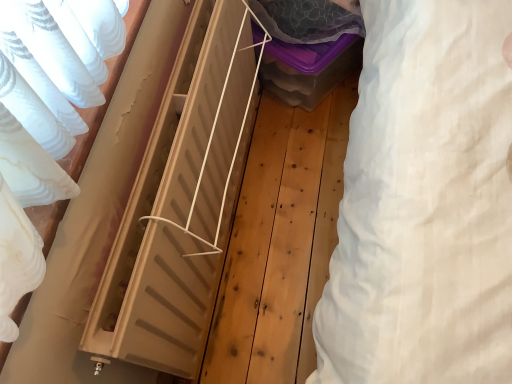
The width and height of the screenshot is (512, 384). Describe the element at coordinates (424, 203) in the screenshot. I see `white cotton sheet at right` at that location.

What are the coordinates of `translucent plastic storage box at center` in the screenshot? It's located at (308, 48).

Measure the distance between natural wood radiator at center and camera.

natural wood radiator at center is 27.64 inches from camera.

Locate an element on the screen. This screenshot has width=512, height=384. white cotton sheet at right is located at coordinates (424, 203).

Between white cotton sheet at right and translucent plastic storage box at center, which one is positioned in front?

white cotton sheet at right.

From the image's perspective, does white cotton sheet at right appear lower than translucent plastic storage box at center?

Yes, from the image's perspective, white cotton sheet at right is beneath translucent plastic storage box at center.

Is white cotton sheet at right not inside translucent plastic storage box at center?

Indeed, white cotton sheet at right is completely outside translucent plastic storage box at center.

In the scene shown: Which of these two, white cotton sheet at right or translucent plastic storage box at center, is bigger?

translucent plastic storage box at center.

Which of these two, white cotton sheet at right or natural wood radiator at center, stands shorter?

With less height is natural wood radiator at center.

Considering the sizes of objects white cotton sheet at right and natural wood radiator at center in the image provided, who is bigger, white cotton sheet at right or natural wood radiator at center?

With larger size is natural wood radiator at center.

Which is more to the right, white cotton sheet at right or natural wood radiator at center?

white cotton sheet at right is more to the right.

Between point (486, 382) and point (112, 328), which one is positioned behind?

The point (112, 328) is behind.

Is natural wood radiator at center not within translucent plastic storage box at center?

Yes, natural wood radiator at center is outside of translucent plastic storage box at center.

From a real-world perspective, is natural wood radiator at center above or below translucent plastic storage box at center?

Clearly, from a real-world perspective, natural wood radiator at center is above translucent plastic storage box at center.

Does natural wood radiator at center come behind translucent plastic storage box at center?

No, natural wood radiator at center is closer to the viewer.

Visually, is translucent plastic storage box at center positioned to the left or to the right of natural wood radiator at center?

Clearly, translucent plastic storage box at center is on the right of natural wood radiator at center in the image.

Is translucent plastic storage box at center turned away from natural wood radiator at center?

No, translucent plastic storage box at center is not facing away from natural wood radiator at center.

In the scene shown: Does translucent plastic storage box at center come in front of natural wood radiator at center?

No, it is behind natural wood radiator at center.

Identify the location of clothing on the right of the natural wood radiator at center. (424, 203).

How many degrees apart are the facing directions of natural wood radiator at center and white cotton sheet at right?

There is a 0.986-degree angle between the facing directions of natural wood radiator at center and white cotton sheet at right.

From a real-world perspective, is natural wood radiator at center positioned under white cotton sheet at right based on gravity?

Yes, from a real-world perspective, natural wood radiator at center is below white cotton sheet at right.

Is translucent plastic storage box at center touching white cotton sheet at right?

They are not placed beside each other.

Is translucent plastic storage box at center positioned with its back to white cotton sheet at right?

That's not correct — translucent plastic storage box at center is not looking away from white cotton sheet at right.

Which of these two, translucent plastic storage box at center or white cotton sheet at right, is wider?

With larger width is translucent plastic storage box at center.

Which object is more forward, translucent plastic storage box at center or white cotton sheet at right?

white cotton sheet at right is closer to the camera.

I want to click on clothing that is below the translucent plastic storage box at center (from the image's perspective), so click(424, 203).

Where is `clothing that appears above the natural wood radiator at center (from the image's perspective)`? The image size is (512, 384). clothing that appears above the natural wood radiator at center (from the image's perspective) is located at coordinates (424, 203).

In the scene shown: Estimate the real-world distances between objects in this image. Which object is further from translucent plastic storage box at center, white cotton sheet at right or natural wood radiator at center?

Among the two, white cotton sheet at right is located further to translucent plastic storage box at center.

From the image, which object appears to be nearer to natural wood radiator at center, white cotton sheet at right or translucent plastic storage box at center?

Among the two, translucent plastic storage box at center is located nearer to natural wood radiator at center.

Considering their positions, is natural wood radiator at center positioned further to translucent plastic storage box at center than white cotton sheet at right?

The object further to translucent plastic storage box at center is white cotton sheet at right.

Estimate the real-world distances between objects in this image. Which object is further from white cotton sheet at right, translucent plastic storage box at center or natural wood radiator at center?

The object further to white cotton sheet at right is translucent plastic storage box at center.

Based on their spatial positions, is translucent plastic storage box at center or white cotton sheet at right closer to natural wood radiator at center?

translucent plastic storage box at center.

Considering their positions, is natural wood radiator at center positioned further to white cotton sheet at right than translucent plastic storage box at center?

Based on the image, translucent plastic storage box at center appears to be further to white cotton sheet at right.

In order to click on radiator between white cotton sheet at right and translucent plastic storage box at center from front to back in this screenshot , I will do `click(180, 201)`.